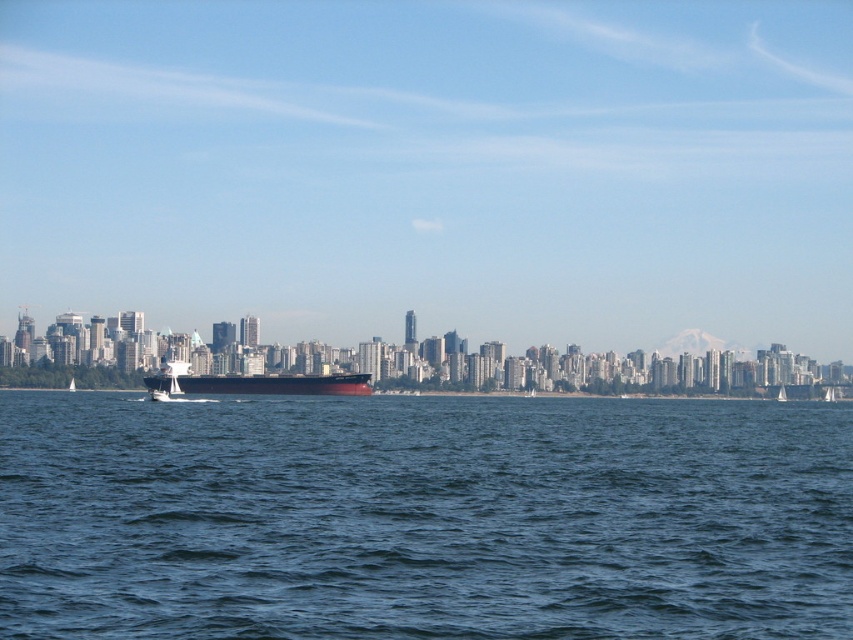
Based on the photo, who is higher up, blue water at center or smooth black ship at center?

smooth black ship at center is above.

Between blue water at center and smooth black ship at center, which one appears on the left side from the viewer's perspective?

Positioned to the left is smooth black ship at center.

Who is more forward, (x=643, y=426) or (x=219, y=392)?

Point (x=643, y=426) is more forward.

Identify the location of blue water at center. (422, 516).